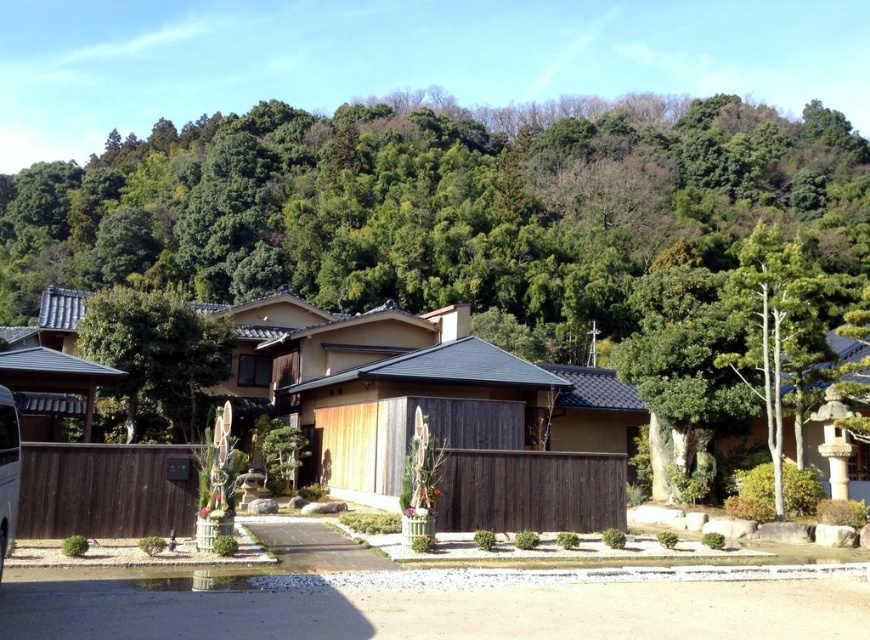
Question: Considering the relative positions of green leafy tree at center and green leafy tree at right in the image provided, where is green leafy tree at center located with respect to green leafy tree at right?

Choices:
 (A) right
 (B) left

Answer: (B)

Question: Which object appears closest to the camera in this image?

Choices:
 (A) green leafy tree at right
 (B) green wood tree at center
 (C) metallic silver van at lower left

Answer: (C)

Question: Is green leafy tree at center in front of metallic silver van at lower left?

Choices:
 (A) yes
 (B) no

Answer: (B)

Question: Among these objects, which one is nearest to the camera?

Choices:
 (A) green leafy tree at center
 (B) metallic silver van at lower left

Answer: (B)

Question: Does smooth asphalt driveway at center have a lesser width compared to green leafy tree at right?

Choices:
 (A) yes
 (B) no

Answer: (A)

Question: Which point is farther to the camera?

Choices:
 (A) (258, 186)
 (B) (3, 483)

Answer: (A)